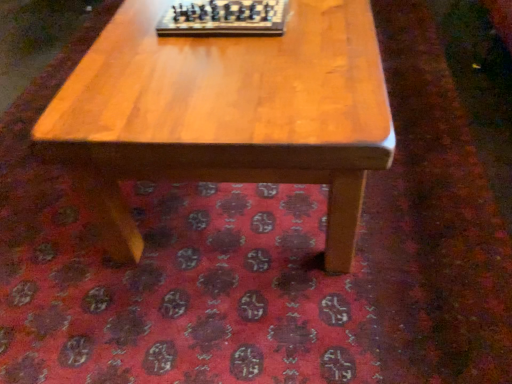
Question: Could wooden chessboard at center be considered to be inside light brown wood coffee table at center?

Choices:
 (A) no
 (B) yes

Answer: (A)

Question: Can you confirm if light brown wood coffee table at center is smaller than wooden chessboard at center?

Choices:
 (A) no
 (B) yes

Answer: (A)

Question: Is light brown wood coffee table at center to the left of wooden chessboard at center from the viewer's perspective?

Choices:
 (A) no
 (B) yes

Answer: (A)

Question: Considering the relative sizes of light brown wood coffee table at center and wooden chessboard at center in the image provided, is light brown wood coffee table at center taller than wooden chessboard at center?

Choices:
 (A) yes
 (B) no

Answer: (A)

Question: Is light brown wood coffee table at center to the right of wooden chessboard at center from the viewer's perspective?

Choices:
 (A) yes
 (B) no

Answer: (A)

Question: From the image's perspective, would you say light brown wood coffee table at center is positioned over wooden chessboard at center?

Choices:
 (A) no
 (B) yes

Answer: (A)

Question: Can you confirm if wooden chessboard at center is positioned to the left of light brown wood coffee table at center?

Choices:
 (A) no
 (B) yes

Answer: (B)

Question: Can you confirm if wooden chessboard at center is thinner than light brown wood coffee table at center?

Choices:
 (A) yes
 (B) no

Answer: (A)

Question: Is wooden chessboard at center at the right side of light brown wood coffee table at center?

Choices:
 (A) no
 (B) yes

Answer: (A)

Question: From the image's perspective, is wooden chessboard at center beneath light brown wood coffee table at center?

Choices:
 (A) yes
 (B) no

Answer: (B)

Question: Is wooden chessboard at center not within light brown wood coffee table at center?

Choices:
 (A) no
 (B) yes

Answer: (B)

Question: From a real-world perspective, is wooden chessboard at center below light brown wood coffee table at center?

Choices:
 (A) no
 (B) yes

Answer: (A)

Question: Relative to wooden chessboard at center, is light brown wood coffee table at center in front or behind?

Choices:
 (A) behind
 (B) front

Answer: (B)